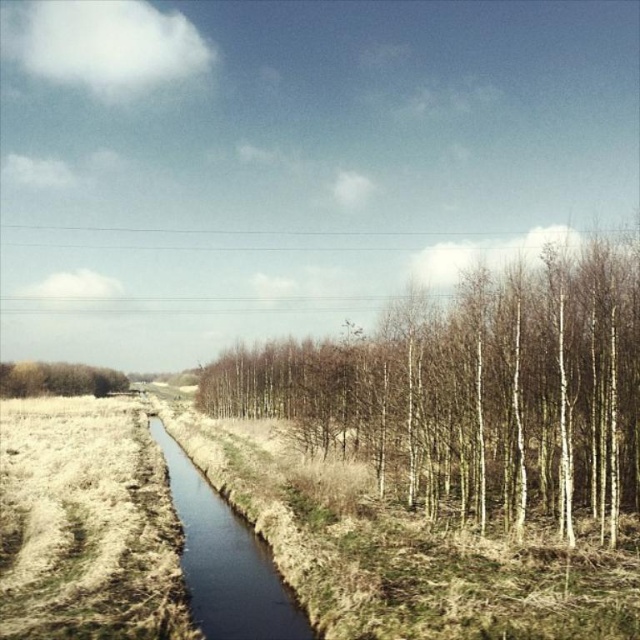
Question: Which point is farther from the camera taking this photo?

Choices:
 (A) (595, 406)
 (B) (193, 509)

Answer: (B)

Question: Is brown grassy stream at center positioned behind brown textured tree at left?

Choices:
 (A) no
 (B) yes

Answer: (A)

Question: Can you confirm if brown grassy stream at center is smaller than brown textured tree at left?

Choices:
 (A) yes
 (B) no

Answer: (A)

Question: Is brown grassy stream at center below brown textured tree at left?

Choices:
 (A) no
 (B) yes

Answer: (B)

Question: Which point appears closest to the camera in this image?

Choices:
 (A) (176, 481)
 (B) (29, 380)

Answer: (A)

Question: Estimate the real-world distances between objects in this image. Which object is closer to the brown textured tree at left?

Choices:
 (A) brown grassy stream at center
 (B) bare wood trees at center

Answer: (B)